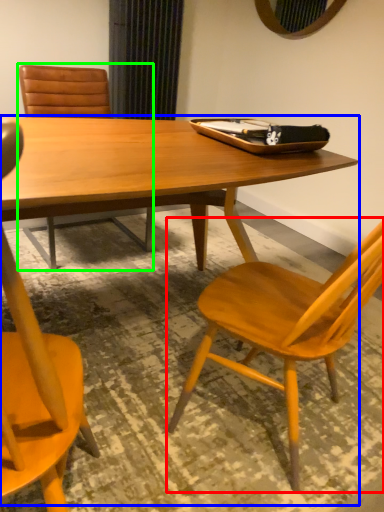
Question: Which object is the farthest from chair (highlighted by a red box)? Choose among these: round table (highlighted by a blue box) or chair (highlighted by a green box).

Choices:
 (A) round table
 (B) chair

Answer: (B)